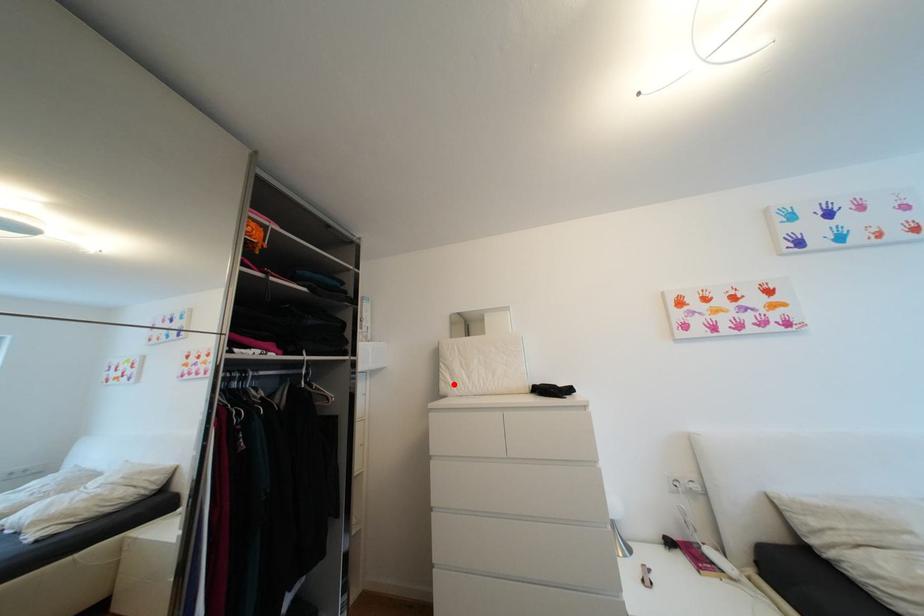
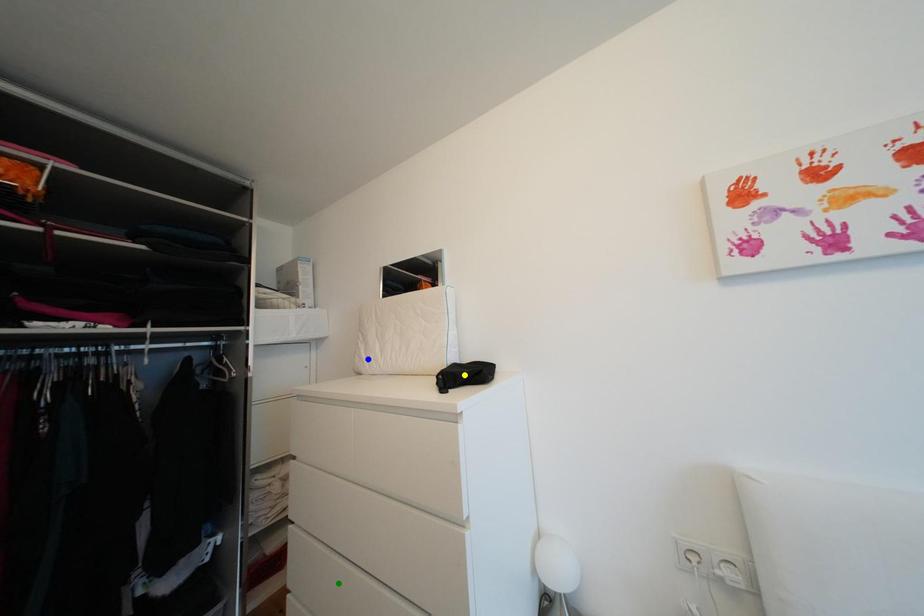
Question: I am providing you with two images of the same scene from different viewpoints. A red point is marked on the first image. You are given multiple points on the second image. Which spot in image 2 lines up with the point in image 1?

Choices:
 (A) yellow point
 (B) blue point
 (C) green point

Answer: (B)